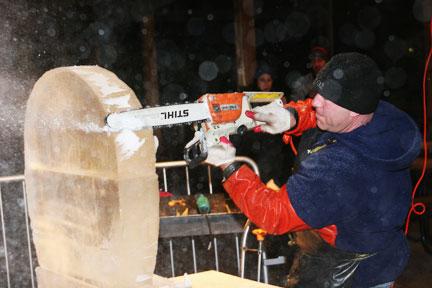
In order to click on wooden circular slab in this screenshot , I will do `click(88, 171)`.